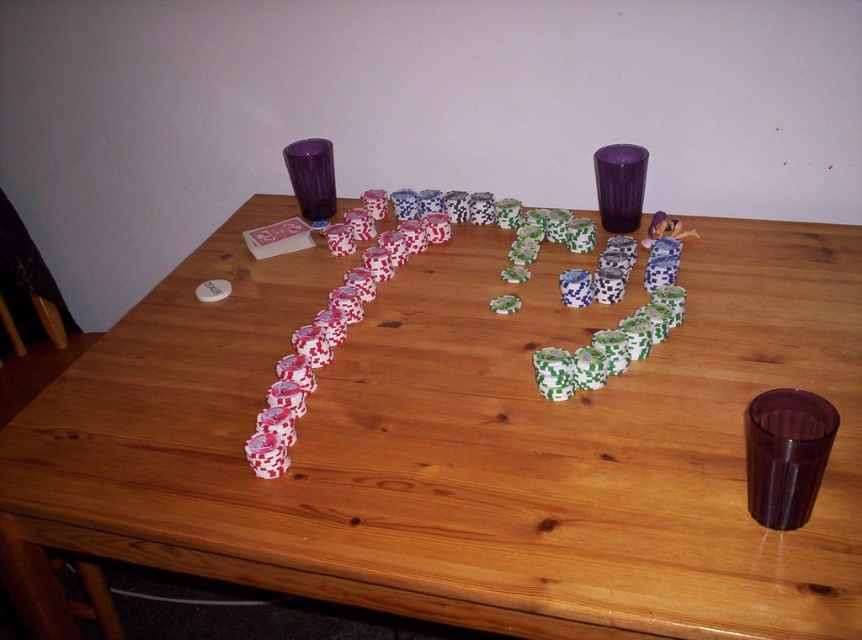
Question: Is transparent purple shot glass at upper center above purple plastic shot glass at upper center?

Choices:
 (A) yes
 (B) no

Answer: (B)

Question: Which object is the closest to the purple plastic shot glass at upper center?

Choices:
 (A) wooden table at center
 (B) transparent plastic shot glass at lower right
 (C) transparent purple shot glass at upper center

Answer: (A)

Question: Which of these objects is positioned closest to the purple plastic shot glass at upper center?

Choices:
 (A) wooden table at center
 (B) transparent purple shot glass at upper center

Answer: (A)

Question: Can you confirm if transparent plastic shot glass at lower right is wider than purple plastic shot glass at upper center?

Choices:
 (A) yes
 (B) no

Answer: (B)

Question: Which point is closer to the camera?

Choices:
 (A) wooden table at center
 (B) transparent plastic shot glass at lower right
 (C) transparent purple shot glass at upper center
 (D) purple plastic shot glass at upper center

Answer: (A)

Question: Is transparent purple shot glass at upper center further to the viewer compared to purple plastic shot glass at upper center?

Choices:
 (A) no
 (B) yes

Answer: (A)